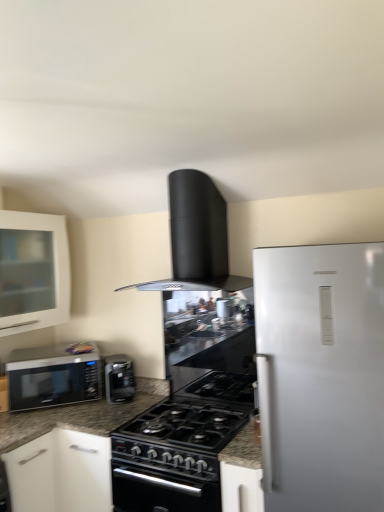
Question: Considering the relative sizes of satin black microwave at left and satin black coffee maker at center in the image provided, is satin black microwave at left thinner than satin black coffee maker at center?

Choices:
 (A) no
 (B) yes

Answer: (A)

Question: Is satin black microwave at left wider than satin black coffee maker at center?

Choices:
 (A) yes
 (B) no

Answer: (A)

Question: Is satin black microwave at left taller than satin black coffee maker at center?

Choices:
 (A) no
 (B) yes

Answer: (B)

Question: Is the depth of satin black microwave at left less than that of satin black coffee maker at center?

Choices:
 (A) yes
 (B) no

Answer: (A)

Question: Is satin black microwave at left smaller than satin black coffee maker at center?

Choices:
 (A) yes
 (B) no

Answer: (B)

Question: Relative to satin black microwave at left, is black matte gas stove at center in front or behind?

Choices:
 (A) behind
 (B) front

Answer: (B)

Question: Is point (158, 415) positioned closer to the camera than point (61, 403)?

Choices:
 (A) farther
 (B) closer

Answer: (B)

Question: From the image's perspective, is black matte gas stove at center positioned above or below satin black microwave at left?

Choices:
 (A) below
 (B) above

Answer: (A)

Question: In terms of size, does black matte gas stove at center appear bigger or smaller than satin black microwave at left?

Choices:
 (A) big
 (B) small

Answer: (A)

Question: Is point (51, 264) positioned closer to the camera than point (13, 387)?

Choices:
 (A) farther
 (B) closer

Answer: (A)

Question: Would you say white glass cabinet at left is to the left or to the right of satin black microwave at left in the picture?

Choices:
 (A) left
 (B) right

Answer: (A)

Question: From a real-world perspective, is white glass cabinet at left physically located above or below satin black microwave at left?

Choices:
 (A) below
 (B) above

Answer: (B)

Question: Looking at their shapes, would you say white glass cabinet at left is wider or thinner than satin black microwave at left?

Choices:
 (A) thin
 (B) wide

Answer: (A)

Question: Considering the positions of satin black microwave at left and black matte range hood at upper center in the image, is satin black microwave at left bigger or smaller than black matte range hood at upper center?

Choices:
 (A) small
 (B) big

Answer: (A)

Question: In the image, is satin black microwave at left positioned in front of or behind black matte range hood at upper center?

Choices:
 (A) behind
 (B) front

Answer: (A)